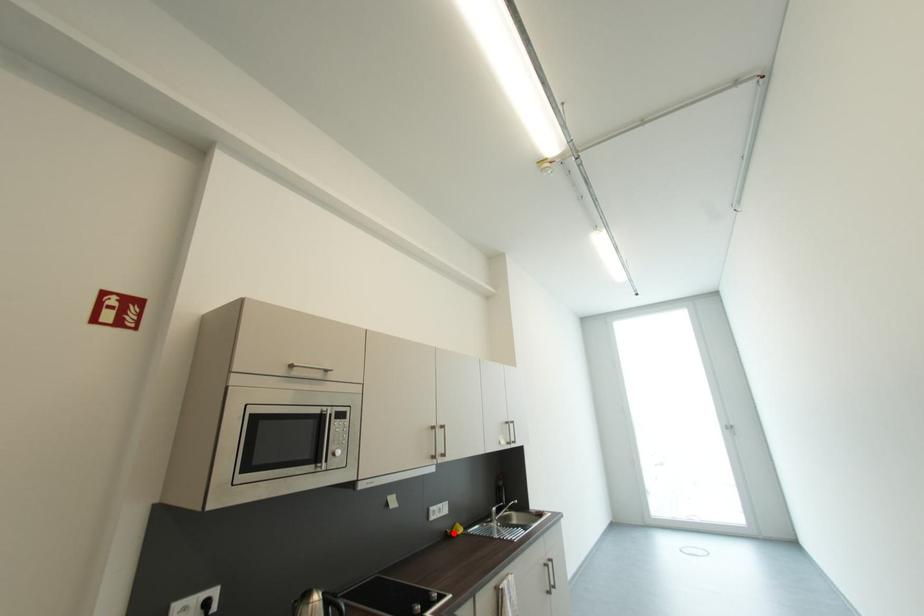
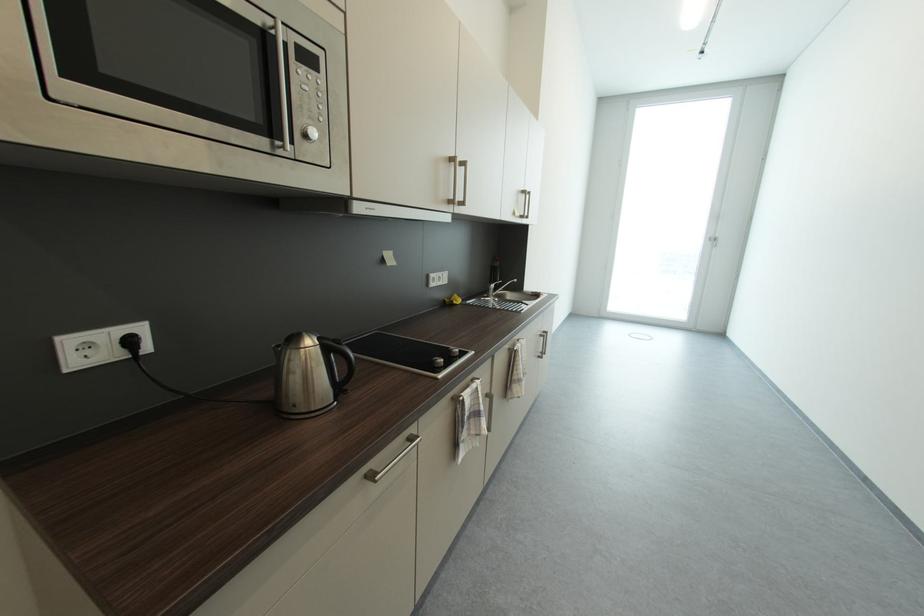
Where in the second image is the point corresponding to the highlighted location from the first image?

(453, 302)